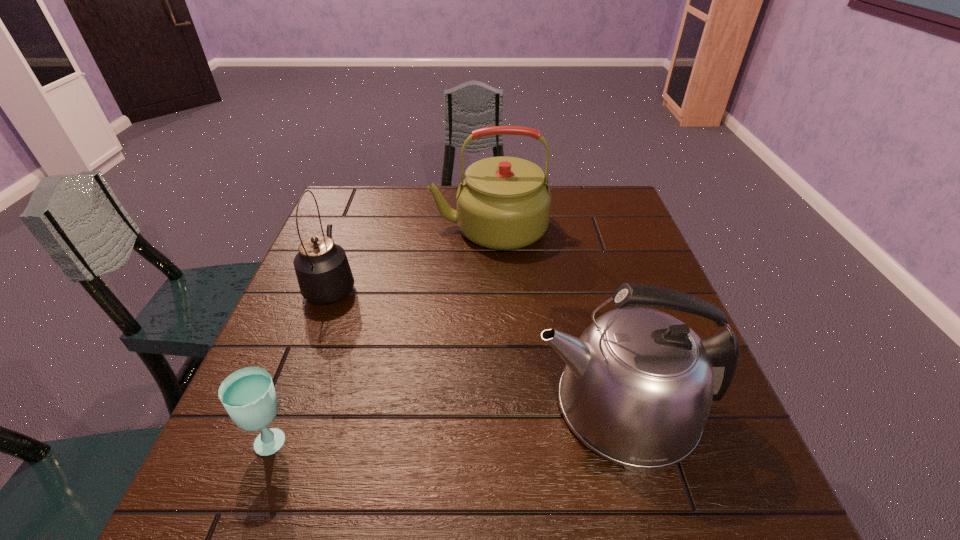
This screenshot has height=540, width=960. What are the coordinates of `free space located on the spout of the nearest kettle` in the screenshot? It's located at (506, 406).

Image resolution: width=960 pixels, height=540 pixels. In order to click on vacant space located spout on the leftmost kettle in this screenshot , I will do `click(366, 196)`.

Find the location of a particular element. The height and width of the screenshot is (540, 960). vacant space located spout on the leftmost kettle is located at coordinates (360, 209).

Find the location of a particular element. vacant point located 0.070m spout on the leftmost kettle is located at coordinates (347, 246).

Where is `free region located on the right of the shortest object`? This screenshot has height=540, width=960. free region located on the right of the shortest object is located at coordinates (369, 440).

I want to click on object present at the far edge, so click(x=503, y=203).

Find the location of a particular element. The height and width of the screenshot is (540, 960). object that is at the near edge is located at coordinates click(x=637, y=388).

Image resolution: width=960 pixels, height=540 pixels. I want to click on kettle at the left edge, so click(x=323, y=272).

What are the coordinates of `glass that is at the left edge` in the screenshot? It's located at (248, 394).

The image size is (960, 540). Find the location of `object that is positioned at the right edge`. object that is positioned at the right edge is located at coordinates (637, 388).